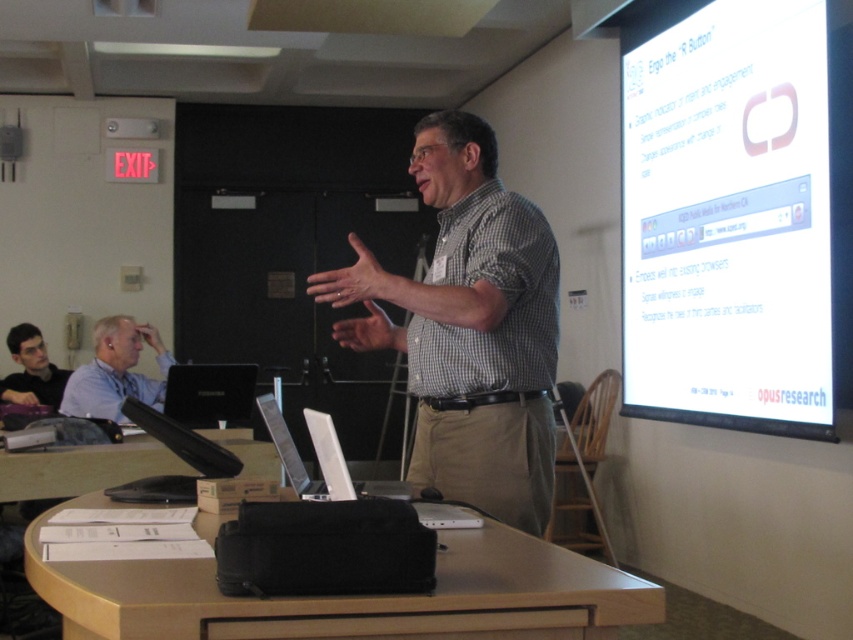
Looking at this image, you are an attendee sitting in the audience of the presentation. You notice the light blue shirt at upper left and the silver metallic laptop at center. Which object appears bigger in the image?

The light blue shirt at upper left appears larger in size than the silver metallic laptop at center.

You are an attendee in the conference room and want to take a photo of the presentation. The white glossy projection screen at upper right and the silver metallic laptop at center are both in your camera frame. Which object is wider in the photo?

The white glossy projection screen at upper right is wider than the silver metallic laptop at center in the photo because its width surpasses the laptop.

You are an attendee sitting in the conference room and want to take a photo of the white glossy projection screen at upper right and the silver metallic laptop at center. Which object will appear larger in your photo?

The white glossy projection screen at upper right will appear larger in your photo because it is closer to you than the silver metallic laptop at center.